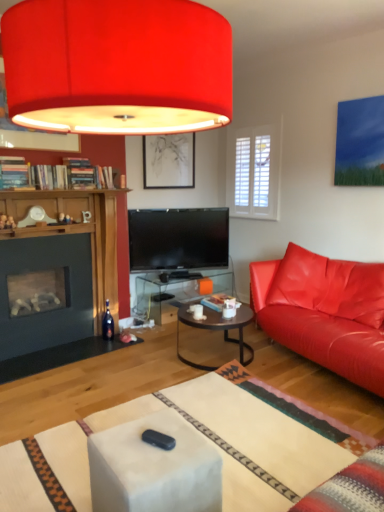
Question: Considering the positions of dark glass wine bottle at lower left and dark brown glass coffee table at center in the image, is dark glass wine bottle at lower left bigger or smaller than dark brown glass coffee table at center?

Choices:
 (A) small
 (B) big

Answer: (A)

Question: From the image's perspective, relative to dark brown glass coffee table at center, is dark glass wine bottle at lower left above or below?

Choices:
 (A) above
 (B) below

Answer: (A)

Question: Which of these objects is positioned closest to the transparent glass table at center?

Choices:
 (A) matte red lampshade at upper center
 (B) matte leather couch at right
 (C) dark brown glass coffee table at center
 (D) matte black picture frame at upper center
 (E) dark glass wine bottle at lower left

Answer: (E)

Question: Estimate the real-world distances between objects in this image. Which object is closer to the matte red lampshade at upper center?

Choices:
 (A) matte black picture frame at upper center
 (B) transparent glass table at center
 (C) dark glass wine bottle at lower left
 (D) dark brown glass coffee table at center
 (E) matte leather couch at right

Answer: (D)